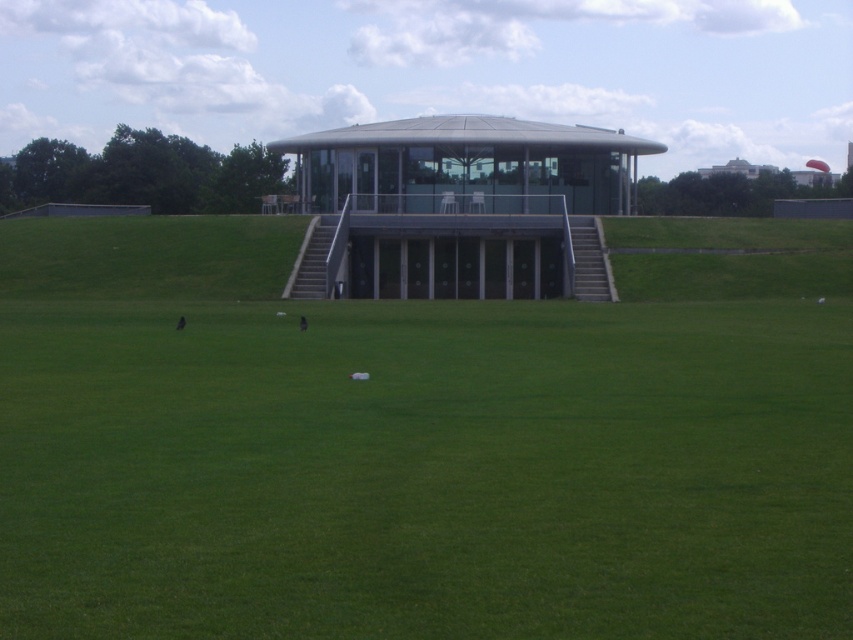
Question: Which point appears closest to the camera in this image?

Choices:
 (A) (212, 556)
 (B) (416, 152)

Answer: (A)

Question: Observing the image, what is the correct spatial positioning of green grass at center in reference to metallic glass gazebo at center?

Choices:
 (A) right
 (B) left

Answer: (B)

Question: Is green grass at center wider than metallic glass gazebo at center?

Choices:
 (A) yes
 (B) no

Answer: (A)

Question: Considering the relative positions of green grass at center and metallic glass gazebo at center in the image provided, where is green grass at center located with respect to metallic glass gazebo at center?

Choices:
 (A) below
 (B) above

Answer: (A)